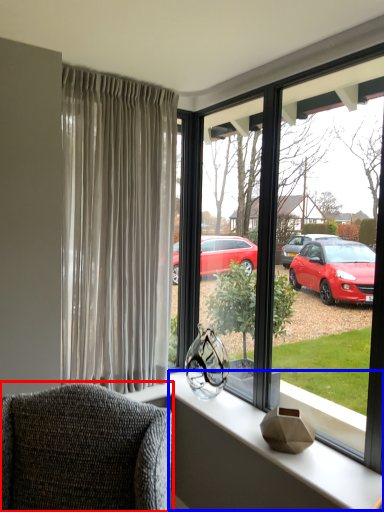
Question: Which point is closer to the camera, chair (highlighted by a red box) or window sill (highlighted by a blue box)?

Choices:
 (A) chair
 (B) window sill

Answer: (A)